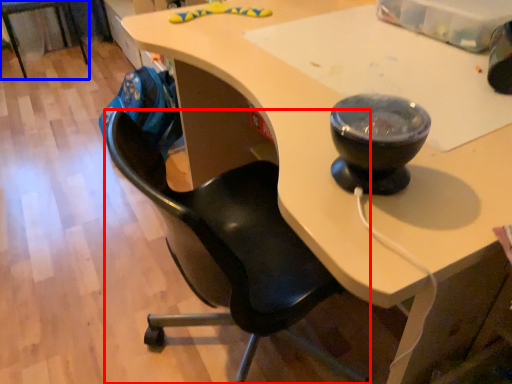
Question: Which object is closer to the camera taking this photo, chair (highlighted by a red box) or chair (highlighted by a blue box)?

Choices:
 (A) chair
 (B) chair

Answer: (A)